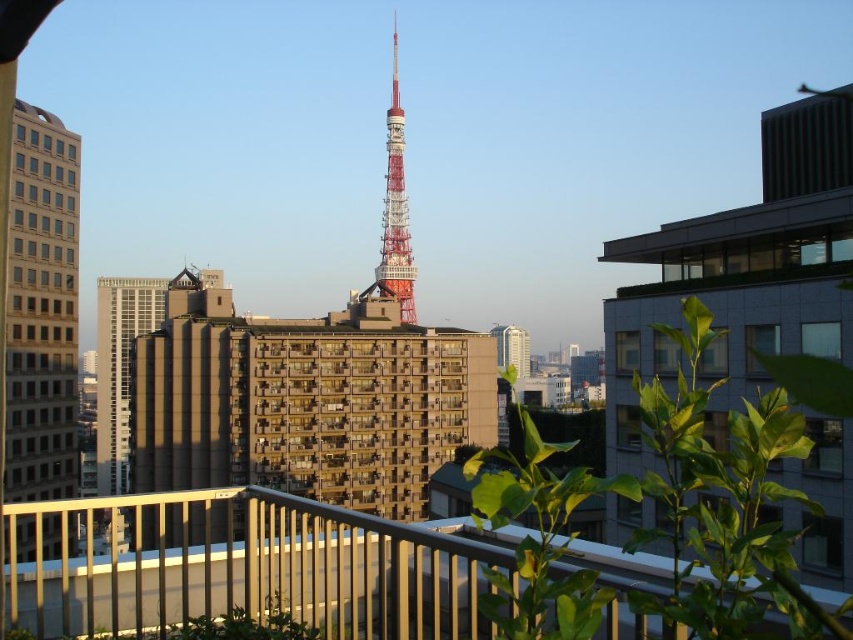
Who is positioned more to the left, matte glass skyscraper at left or metallic silver skyscraper at center?

matte glass skyscraper at left is more to the left.

Does point (28, 340) come closer to viewer compared to point (521, 356)?

That is True.

Where is `matte glass skyscraper at left`? The image size is (853, 640). matte glass skyscraper at left is located at coordinates (42, 308).

Is metallic railing at lower center closer to camera compared to metallic red tower at center?

Yes.

In the scene shown: Is metallic railing at lower center bigger than metallic red tower at center?

Yes.

Who is more forward, (352, 627) or (384, 241)?

Positioned in front is point (352, 627).

You are a GUI agent. You are given a task and a screenshot of the screen. Output one action in this format:
    pyautogui.click(x=<x>, y=<y>)
    Task: Click on the metallic railing at lower center
    The height and width of the screenshot is (640, 853).
    Given the screenshot: What is the action you would take?
    pyautogui.click(x=247, y=566)

Can you confirm if matte brown building at center is positioned below matte glass skyscraper at left?

Correct, matte brown building at center is located below matte glass skyscraper at left.

The height and width of the screenshot is (640, 853). What do you see at coordinates (161, 381) in the screenshot? I see `matte brown building at center` at bounding box center [161, 381].

You are a GUI agent. You are given a task and a screenshot of the screen. Output one action in this format:
    pyautogui.click(x=<x>, y=<y>)
    Task: Click on the matte brown building at center
    The image size is (853, 640).
    Given the screenshot: What is the action you would take?
    pyautogui.click(x=161, y=381)